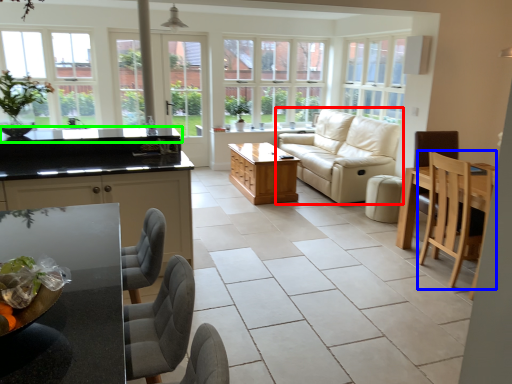
Question: Which is farther away from studio couch (highlighted by a red box)? chair (highlighted by a blue box) or countertop (highlighted by a green box)?

Choices:
 (A) chair
 (B) countertop

Answer: (B)